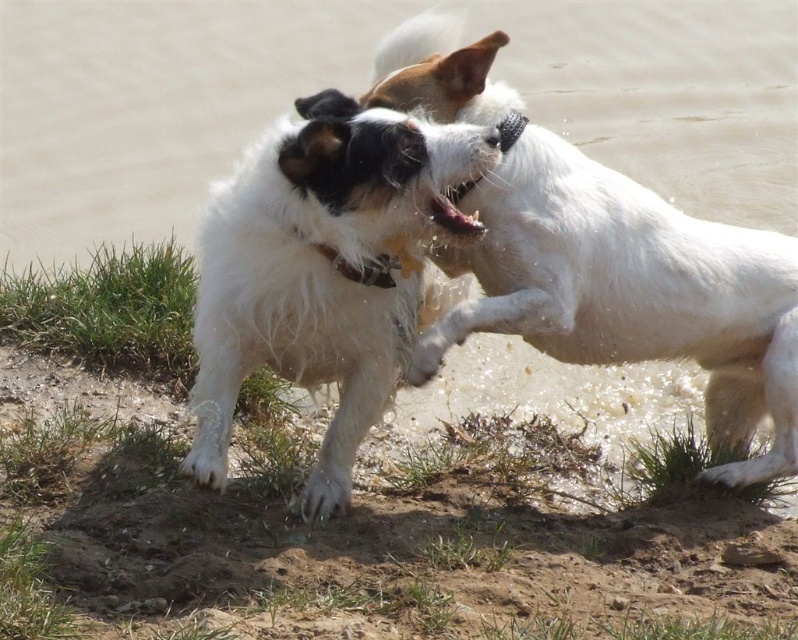
Question: Is dry sandy soil at lower center thinner than white fluffy dog at center?

Choices:
 (A) no
 (B) yes

Answer: (A)

Question: Which of the following is the farthest from the observer?

Choices:
 (A) white fluffy dog at center
 (B) white fur dog at center
 (C) dry sandy soil at lower center

Answer: (B)

Question: Is dry sandy soil at lower center behind white fluffy dog at center?

Choices:
 (A) yes
 (B) no

Answer: (B)

Question: Among these points, which one is farthest from the camera?

Choices:
 (A) (437, 189)
 (B) (449, 116)

Answer: (B)

Question: Estimate the real-world distances between objects in this image. Which object is farther from the dry sandy soil at lower center?

Choices:
 (A) white fur dog at center
 (B) white fluffy dog at center

Answer: (A)

Question: Is white fur dog at center smaller than white fluffy dog at center?

Choices:
 (A) yes
 (B) no

Answer: (B)